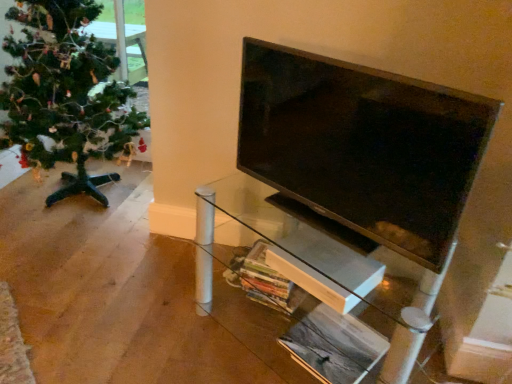
Question: Is green matte christmas tree at left positioned far away from matte black tv at center?

Choices:
 (A) yes
 (B) no

Answer: (A)

Question: Considering the relative positions of green matte christmas tree at left and matte black tv at center in the image provided, is green matte christmas tree at left to the right of matte black tv at center from the viewer's perspective?

Choices:
 (A) no
 (B) yes

Answer: (A)

Question: Is green matte christmas tree at left not within matte black tv at center?

Choices:
 (A) yes
 (B) no

Answer: (A)

Question: Is green matte christmas tree at left facing away from matte black tv at center?

Choices:
 (A) yes
 (B) no

Answer: (B)

Question: From a real-world perspective, is green matte christmas tree at left located higher than matte black tv at center?

Choices:
 (A) yes
 (B) no

Answer: (B)

Question: From the image's perspective, would you say green matte christmas tree at left is positioned over matte black tv at center?

Choices:
 (A) no
 (B) yes

Answer: (B)

Question: Is matte black tv at center in contact with transparent glass tv stand at center?

Choices:
 (A) yes
 (B) no

Answer: (B)

Question: Is matte black tv at center shorter than transparent glass tv stand at center?

Choices:
 (A) yes
 (B) no

Answer: (A)

Question: Does matte black tv at center appear on the left side of transparent glass tv stand at center?

Choices:
 (A) no
 (B) yes

Answer: (B)

Question: Is matte black tv at center surrounding transparent glass tv stand at center?

Choices:
 (A) no
 (B) yes

Answer: (A)

Question: Does matte black tv at center come in front of transparent glass tv stand at center?

Choices:
 (A) no
 (B) yes

Answer: (B)

Question: Is there a large distance between matte black tv at center and transparent glass tv stand at center?

Choices:
 (A) yes
 (B) no

Answer: (B)

Question: Is matte black tv at center positioned in front of green matte christmas tree at left?

Choices:
 (A) yes
 (B) no

Answer: (A)